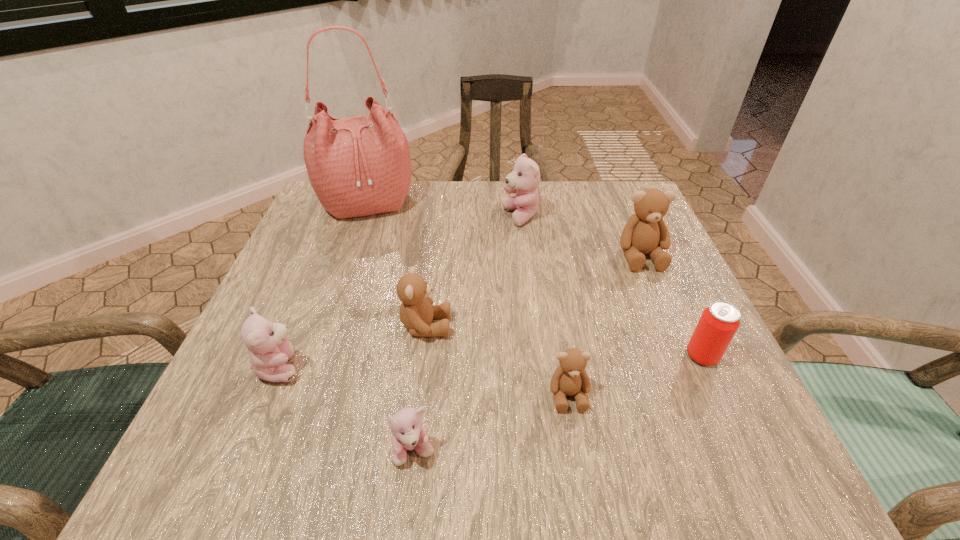
Where is `object at the far left corner`? Image resolution: width=960 pixels, height=540 pixels. object at the far left corner is located at coordinates (358, 166).

I want to click on free space at the far edge of the desktop, so click(x=501, y=200).

You are a GUI agent. You are given a task and a screenshot of the screen. Output one action in this format:
    pyautogui.click(x=<x>, y=<y>)
    Task: Click on the free region at the near edge
    
    Given the screenshot: What is the action you would take?
    pyautogui.click(x=342, y=421)

This screenshot has width=960, height=540. Identify the location of free spot at the left edge of the desktop. (326, 308).

Find the location of a particular element. The image size is (960, 540). free space at the right edge is located at coordinates (689, 336).

Locate an element on the screen. The width and height of the screenshot is (960, 540). blank area at the far left corner is located at coordinates (348, 228).

The width and height of the screenshot is (960, 540). In order to click on vacant area at the far right corner in this screenshot , I will do tap(597, 183).

Find the location of a particular element. vacant space at the near right corner of the desktop is located at coordinates (747, 424).

Locate an element on the screen. free spot between the nearest teddy bear and the handbag is located at coordinates (391, 327).

You are a GUI agent. You are given a task and a screenshot of the screen. Output one action in this format:
    pyautogui.click(x=<x>, y=<y>)
    Task: Click on the empty space between the handbag and the farthest brown teddy bear
    The width and height of the screenshot is (960, 540).
    Given the screenshot: What is the action you would take?
    pyautogui.click(x=504, y=230)